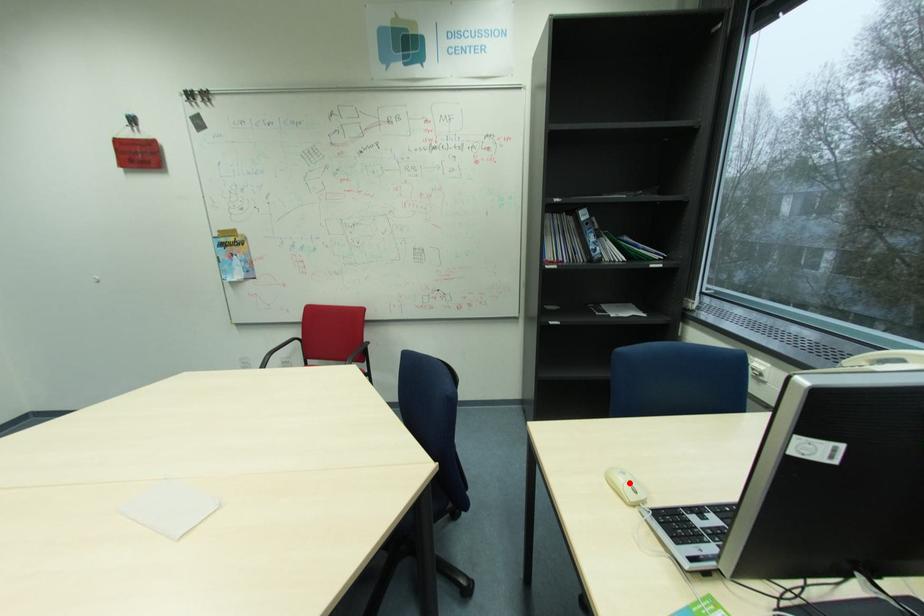
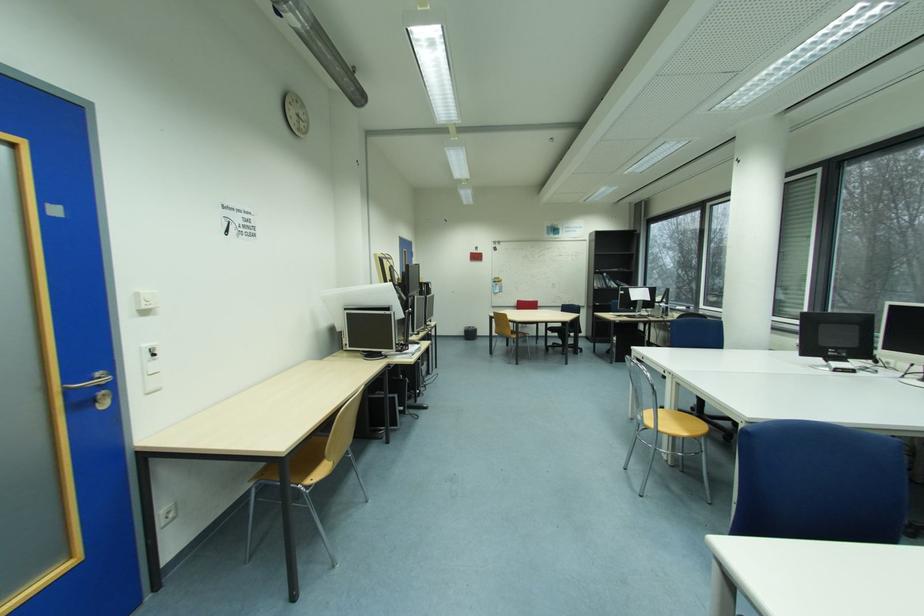
Question: I am providing you with two images of the same scene from different viewpoints. A red point is marked on the first image. Is the red point's position out of view in image 2?

Choices:
 (A) Yes
 (B) No

Answer: (A)